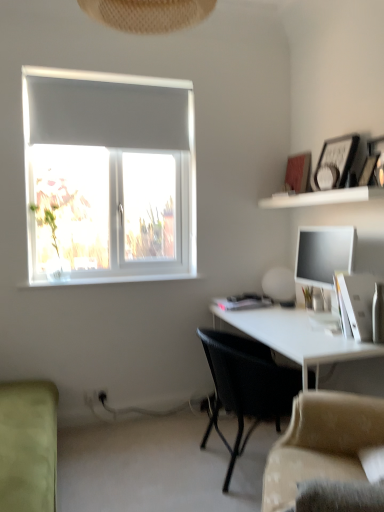
Where is `free region under black woven chair at center (from a real-world perspective)`? This screenshot has width=384, height=512. free region under black woven chair at center (from a real-world perspective) is located at coordinates (225, 460).